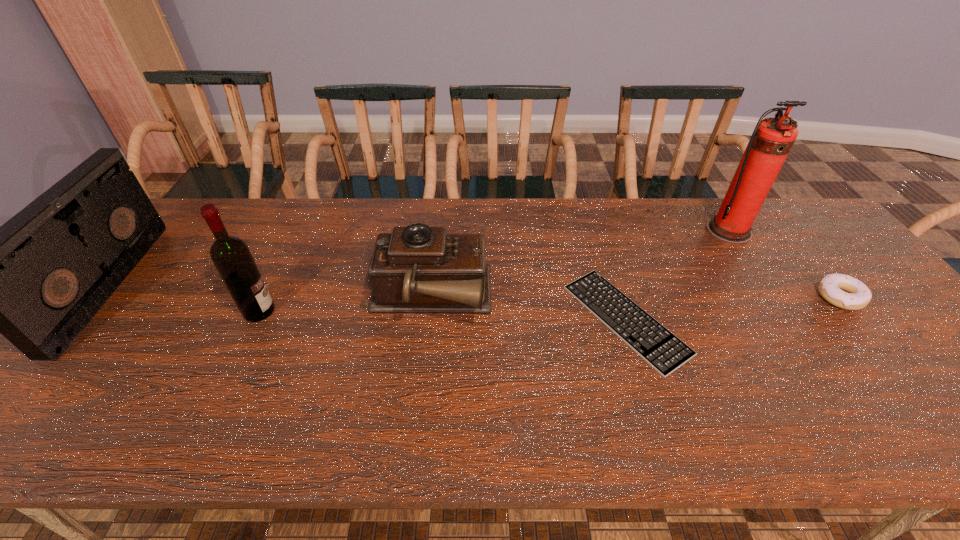
Locate an element on the screen. empty space that is in between the second object from right to left and the rightmost object is located at coordinates (784, 264).

Locate an element on the screen. empty space between the second object from right to left and the fourth object from left to right is located at coordinates (677, 275).

At what (x,y) coordinates should I click in order to perform the action: click on empty space between the fifth object from left to right and the fifth tallest object. Please return your answer as a coordinate pair (x, y). The width and height of the screenshot is (960, 540). Looking at the image, I should click on (784, 264).

At what (x,y) coordinates should I click in order to perform the action: click on object that stands as the third closest to the leftmost object. Please return your answer as a coordinate pair (x, y). The width and height of the screenshot is (960, 540). Looking at the image, I should click on (659, 347).

Identify which object is the second closest to the videotape. Please provide its 2D coordinates. Your answer should be formatted as a tuple, i.e. [(x, y)], where the tuple contains the x and y coordinates of a point satisfying the conditions above.

[(418, 269)]

The image size is (960, 540). I want to click on free spot that satisfies the following two spatial constraints: 1. on the front and back of the shortest object; 2. on the right side of the second object from left to right, so click(255, 320).

You are a GUI agent. You are given a task and a screenshot of the screen. Output one action in this format:
    pyautogui.click(x=<x>, y=<y>)
    Task: Click on the free spot that satisfies the following two spatial constraints: 1. at the discharge end of the rightmost object; 2. on the right side of the fire extinguisher
    This screenshot has width=960, height=540.
    Given the screenshot: What is the action you would take?
    [x=772, y=297]

The width and height of the screenshot is (960, 540). Identify the location of free spot that satisfies the following two spatial constraints: 1. on the back side of the fifth tallest object; 2. on the front side of the videotape. (831, 285).

You are a GUI agent. You are given a task and a screenshot of the screen. Output one action in this format:
    pyautogui.click(x=<x>, y=<y>)
    Task: Click on the vacant position in the image that satisfies the following two spatial constraints: 1. at the discharge end of the fifth object from left to right; 2. on the horn of the phonograph_record
    
    Given the screenshot: What is the action you would take?
    pyautogui.click(x=772, y=298)

Where is `free spot that satisfies the following two spatial constraints: 1. on the front and back of the fifth object from right to left; 2. on the right side of the shortest object`? This screenshot has height=540, width=960. free spot that satisfies the following two spatial constraints: 1. on the front and back of the fifth object from right to left; 2. on the right side of the shortest object is located at coordinates (255, 320).